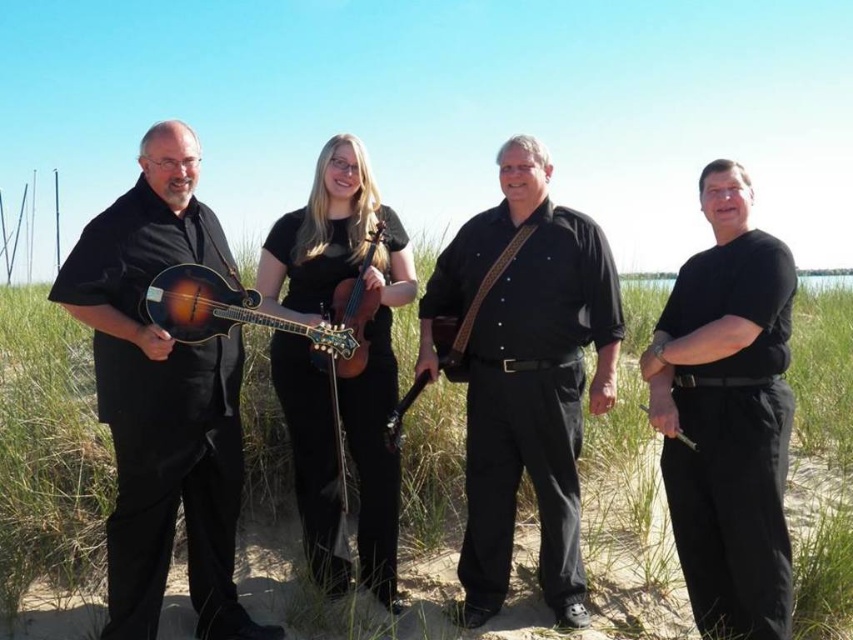
Is black matte pants at right to the right of glossy wood guitar at center from the viewer's perspective?

Yes, black matte pants at right is to the right of glossy wood guitar at center.

Is black matte pants at right closer to camera compared to glossy wood guitar at center?

Yes, black matte pants at right is closer to the viewer.

Is point (672, 426) less distant than point (448, 317)?

That is True.

What are the coordinates of `black matte pants at right` in the screenshot? It's located at (727, 416).

Does point (161, 474) come farther from viewer compared to point (643, 410)?

No, (161, 474) is in front of (643, 410).

Is point (228, 580) more distant than point (641, 406)?

No, it is in front of (641, 406).

Where is `satin wood mandolin at left`? The height and width of the screenshot is (640, 853). satin wood mandolin at left is located at coordinates (161, 397).

Is sunburst wood mandolin at left positioned at the back of wooden guitar at center?

No, sunburst wood mandolin at left is in front of wooden guitar at center.

Can you confirm if sunburst wood mandolin at left is taller than wooden guitar at center?

Correct, sunburst wood mandolin at left is much taller as wooden guitar at center.

Which is in front, point (349, 340) or point (688, 444)?

Point (688, 444) is in front.

You are a GUI agent. You are given a task and a screenshot of the screen. Output one action in this format:
    pyautogui.click(x=<x>, y=<y>)
    Task: Click on the sunburst wood mandolin at left
    Image resolution: width=853 pixels, height=640 pixels.
    Given the screenshot: What is the action you would take?
    pyautogui.click(x=224, y=310)